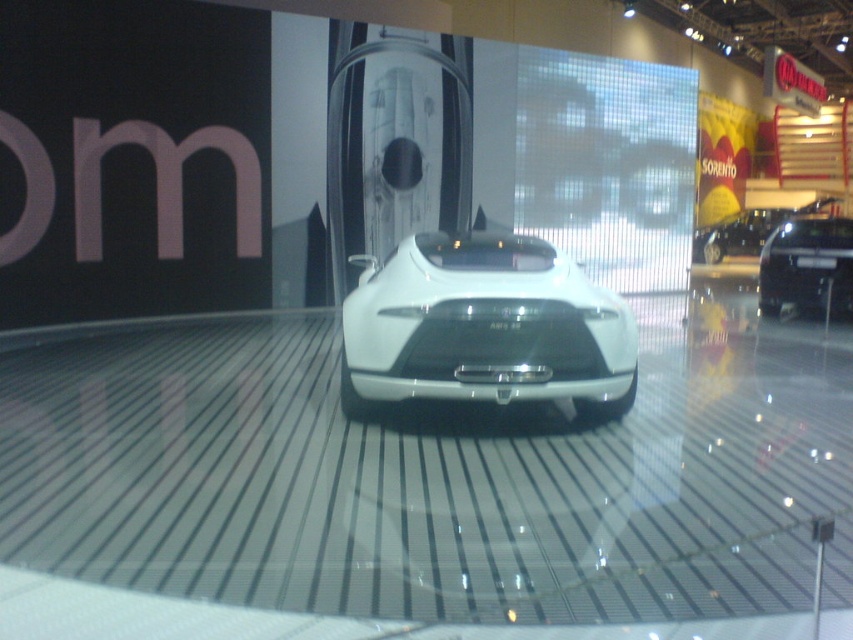
Question: Can you confirm if white glossy sports car at center is positioned to the left of satin black car at center?

Choices:
 (A) yes
 (B) no

Answer: (A)

Question: Which object is positioned closest to the black glossy car at center?

Choices:
 (A) satin black car at center
 (B) white glossy sports car at center

Answer: (B)

Question: Which object is the farthest from the satin black car at center?

Choices:
 (A) white glossy sports car at center
 (B) black glossy car at center

Answer: (A)

Question: Does white glossy sports car at center appear under black glossy car at center?

Choices:
 (A) no
 (B) yes

Answer: (B)

Question: Which object is closer to the camera taking this photo?

Choices:
 (A) black glossy car at center
 (B) white glossy sports car at center
 (C) satin black car at center

Answer: (B)

Question: Does white glossy sports car at center have a greater width compared to black glossy car at center?

Choices:
 (A) yes
 (B) no

Answer: (B)